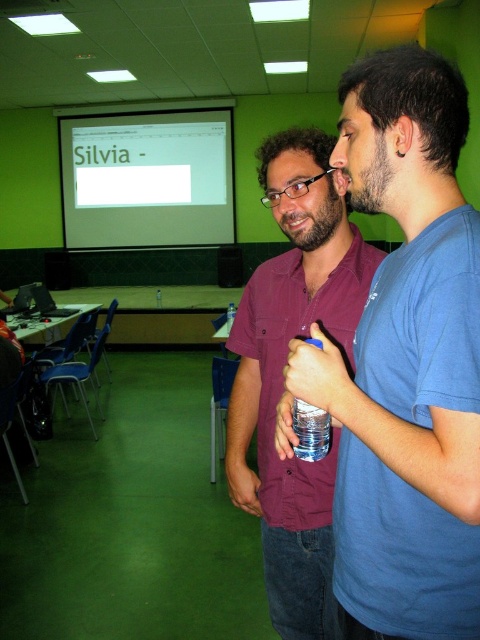
You are a student who needs to reach the white glossy projection screen at upper center from where you are standing near the clear plastic bottle at center. Can you walk directly to it without any obstacles?

The distance between the white glossy projection screen at upper center and the clear plastic bottle at center is 6.59 meters. Since there are no mentioned obstacles in the scene description, you can walk directly to it.